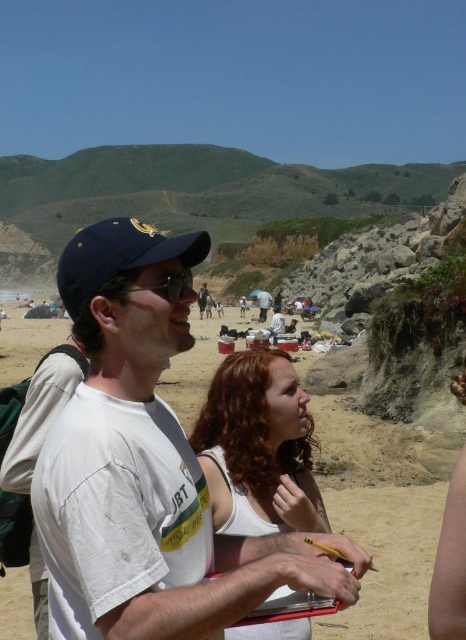
Is the position of matte black sunglasses at center more distant than that of white cotton shirt at center?

No, matte black sunglasses at center is in front of white cotton shirt at center.

Can you confirm if matte black sunglasses at center is smaller than white cotton shirt at center?

Yes, matte black sunglasses at center is smaller than white cotton shirt at center.

Between point (157, 282) and point (260, 317), which one is positioned behind?

Point (260, 317)

At what (x,y) coordinates should I click in order to perform the action: click on matte black sunglasses at center. Please return your answer as a coordinate pair (x, y). This screenshot has height=640, width=466. Looking at the image, I should click on (163, 285).

Find the location of a particular element. This screenshot has height=640, width=466. white cotton shirt at center is located at coordinates (264, 304).

Can you confirm if white cotton shirt at center is positioned to the left of matte black backpack at center?

In fact, white cotton shirt at center is to the right of matte black backpack at center.

Where is `white cotton shirt at center`? This screenshot has height=640, width=466. white cotton shirt at center is located at coordinates (264, 304).

Which is above, navy blue fabric baseball cap at left or matte black backpack at center?

matte black backpack at center is higher up.

Who is shorter, navy blue fabric baseball cap at left or matte black backpack at center?

navy blue fabric baseball cap at left

Between point (204, 232) and point (205, 304), which one is positioned in front?

Point (204, 232)

I want to click on navy blue fabric baseball cap at left, so click(x=118, y=257).